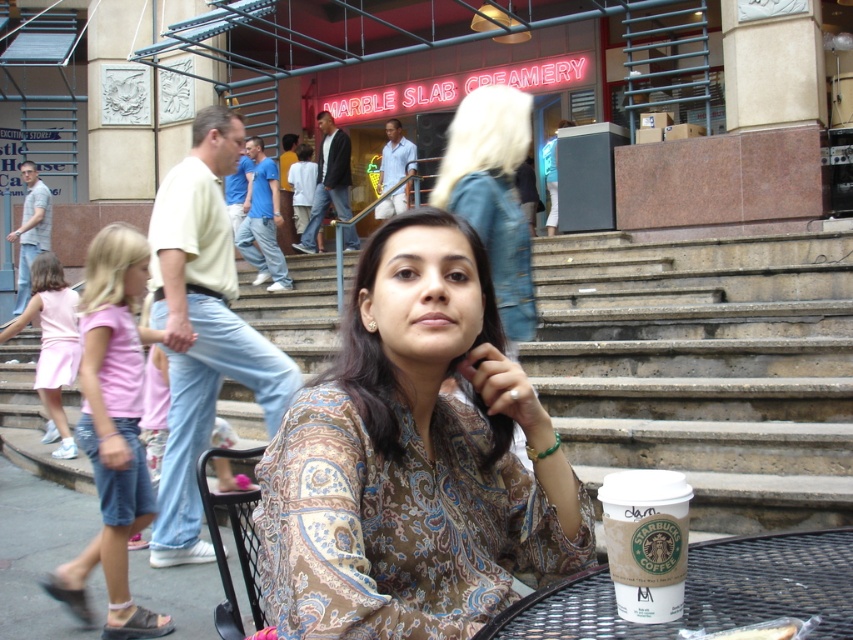
Question: Among these points, which one is nearest to the camera?

Choices:
 (A) (671, 580)
 (B) (529, 253)
 (C) (25, 316)

Answer: (A)

Question: From the image, what is the correct spatial relationship of brown paisley shirt at center in relation to metallic mesh table at lower center?

Choices:
 (A) left
 (B) right

Answer: (A)

Question: Does brown paisley shirt at center have a lesser width compared to metallic mesh table at lower center?

Choices:
 (A) no
 (B) yes

Answer: (B)

Question: Which point appears closest to the camera in this image?

Choices:
 (A) (67, 362)
 (B) (518, 378)
 (C) (448, 186)
 (D) (645, 625)

Answer: (D)

Question: Is white paper cup at lower right smaller than pink fabric dress at lower left?

Choices:
 (A) yes
 (B) no

Answer: (A)

Question: Which of the following is the closest to the observer?

Choices:
 (A) (500, 262)
 (B) (305, 416)

Answer: (B)